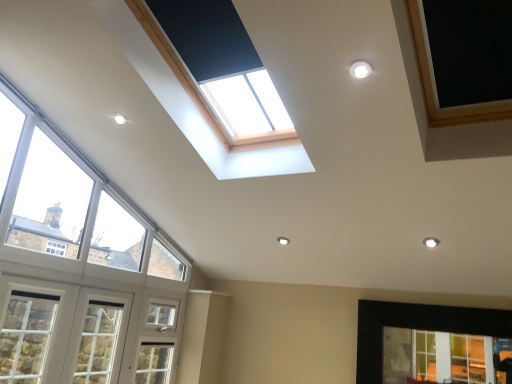
Measure the distance between point (18, 307) and camera.

A distance of 8.91 feet exists between point (18, 307) and camera.

What do you see at coordinates (26, 336) in the screenshot? I see `white painted wood window at lower left, placed as the fourth window when sorted from right to left` at bounding box center [26, 336].

The width and height of the screenshot is (512, 384). What do you see at coordinates (157, 342) in the screenshot? I see `white textured screen door at lower left` at bounding box center [157, 342].

Measure the distance between white textured screen door at lower left and camera.

The distance of white textured screen door at lower left from camera is 3.54 meters.

I want to click on white wood window at lower left, arranged as the third window when viewed from the right, so click(61, 332).

Is white textured screen door at lower left wider or thinner than white painted wood window at lower left, placed as the fourth window when sorted from right to left?

white textured screen door at lower left is thinner than white painted wood window at lower left, placed as the fourth window when sorted from right to left.

From the image's perspective, is white textured screen door at lower left above white painted wood window at lower left, placed as the fourth window when sorted from right to left?

No.

In the scene shown: From a real-world perspective, is white textured screen door at lower left positioned under white painted wood window at lower left, placed as the fourth window when sorted from right to left, based on gravity?

Yes, from a real-world perspective, white textured screen door at lower left is below white painted wood window at lower left, placed as the fourth window when sorted from right to left.

How different are the orientations of white textured screen door at lower left and white painted wood window at lower left, positioned as the 1th window in left-to-right order, in degrees?

The facing directions of white textured screen door at lower left and white painted wood window at lower left, positioned as the 1th window in left-to-right order, are 0.00046 degrees apart.

Can you see white wood window at lower left, arranged as the 2th window when viewed from the left, touching clear glass window at lower right, which is the fourth window from left to right?

They are not placed beside each other.

How distant is white wood window at lower left, arranged as the 2th window when viewed from the left, from clear glass window at lower right, the 1th window positioned from the right?

A distance of 7.52 feet exists between white wood window at lower left, arranged as the 2th window when viewed from the left, and clear glass window at lower right, the 1th window positioned from the right.

Does white wood window at lower left, arranged as the third window when viewed from the right, turn towards clear glass window at lower right, the 1th window positioned from the right?

Yes, white wood window at lower left, arranged as the third window when viewed from the right, is oriented towards clear glass window at lower right, the 1th window positioned from the right.

Who is more distant, white wood window at lower left, arranged as the third window when viewed from the right, or white textured screen door at lower left?

Positioned behind is white textured screen door at lower left.

Could you tell me if white wood window at lower left, arranged as the third window when viewed from the right, is turned towards white textured screen door at lower left?

No, white wood window at lower left, arranged as the third window when viewed from the right, is not oriented towards white textured screen door at lower left.

Can you confirm if white wood window at lower left, arranged as the third window when viewed from the right, is thinner than white textured screen door at lower left?

No.

From a real-world perspective, which object stands above the other?

clear glass window at left, placed as the third window when sorted from left to right.

In the scene shown: Is clear glass window at lower right, which is the fourth window from left to right, positioned with its back to clear glass window at left, which is the 2th window from right to left?

clear glass window at lower right, which is the fourth window from left to right, does not have its back to clear glass window at left, which is the 2th window from right to left.

Locate an element on the screen. the 3rd window in front when counting from the clear glass window at lower right, the 1th window positioned from the right is located at coordinates (77, 267).

Is clear glass window at lower right, the 1th window positioned from the right, far from clear glass window at left, which is the 2th window from right to left?

Yes, clear glass window at lower right, the 1th window positioned from the right, and clear glass window at left, which is the 2th window from right to left, are located far from each other.

From their relative heights in the image, would you say white painted wood window at lower left, positioned as the 1th window in left-to-right order, is taller or shorter than white textured screen door at lower left?

Considering their sizes, white painted wood window at lower left, positioned as the 1th window in left-to-right order, has less height than white textured screen door at lower left.

Is white painted wood window at lower left, placed as the fourth window when sorted from right to left, with white textured screen door at lower left?

No, white painted wood window at lower left, placed as the fourth window when sorted from right to left, is not next to white textured screen door at lower left.

Considering the relative sizes of white painted wood window at lower left, positioned as the 1th window in left-to-right order, and white textured screen door at lower left in the image provided, is white painted wood window at lower left, positioned as the 1th window in left-to-right order, bigger than white textured screen door at lower left?

No, white painted wood window at lower left, positioned as the 1th window in left-to-right order, is not bigger than white textured screen door at lower left.

Is the position of white painted wood window at lower left, positioned as the 1th window in left-to-right order, less distant than that of white textured screen door at lower left?

Yes, white painted wood window at lower left, positioned as the 1th window in left-to-right order, is closer to the viewer.

Does point (141, 350) come closer to viewer compared to point (386, 317)?

No.

From the image's perspective, is white textured screen door at lower left beneath clear glass window at lower right, the 1th window positioned from the right?

Yes, from the image's perspective, white textured screen door at lower left is below clear glass window at lower right, the 1th window positioned from the right.

Is white textured screen door at lower left beside clear glass window at lower right, the 1th window positioned from the right?

white textured screen door at lower left is not next to clear glass window at lower right, the 1th window positioned from the right, and they're not touching.

Is white textured screen door at lower left facing towards clear glass window at lower right, the 1th window positioned from the right?

Yes, white textured screen door at lower left is aimed at clear glass window at lower right, the 1th window positioned from the right.

Is clear glass window at left, placed as the third window when sorted from left to right, positioned with its back to white wood window at lower left, arranged as the third window when viewed from the right?

clear glass window at left, placed as the third window when sorted from left to right, does not have its back to white wood window at lower left, arranged as the third window when viewed from the right.

Looking at this image, from the image's perspective, would you say clear glass window at left, which is the 2th window from right to left, is positioned over white wood window at lower left, arranged as the 2th window when viewed from the left?

Yes, from the image's perspective, clear glass window at left, which is the 2th window from right to left, is above white wood window at lower left, arranged as the 2th window when viewed from the left.

From the clear glass window at left, which is the 2th window from right to left, count the 1st window to the left and point to it. Please provide its 2D coordinates.

[(61, 332)]

Choose the correct answer: Is clear glass window at left, which is the 2th window from right to left, inside white wood window at lower left, arranged as the third window when viewed from the right, or outside it?

clear glass window at left, which is the 2th window from right to left, is outside white wood window at lower left, arranged as the third window when viewed from the right.

Where is `window that is the 3rd object to the left of the white textured screen door at lower left, starting at the anchor`? The width and height of the screenshot is (512, 384). window that is the 3rd object to the left of the white textured screen door at lower left, starting at the anchor is located at coordinates (26, 336).

From the image's perspective, which window is the 1st one above the clear glass window at lower right, which is the fourth window from left to right? Please provide its 2D coordinates.

[(61, 332)]

Considering their positions, is white wood window at lower left, arranged as the third window when viewed from the right, positioned closer to clear glass window at left, placed as the third window when sorted from left to right, than white painted wood window at lower left, placed as the fourth window when sorted from right to left?

Based on the image, white wood window at lower left, arranged as the third window when viewed from the right, appears to be nearer to clear glass window at left, placed as the third window when sorted from left to right.

From the image, which object appears to be nearer to white textured screen door at lower left, clear glass window at left, placed as the third window when sorted from left to right, or white wood window at lower left, arranged as the 2th window when viewed from the left?

clear glass window at left, placed as the third window when sorted from left to right.

Estimate the real-world distances between objects in this image. Which object is further from white textured screen door at lower left, clear glass window at left, placed as the third window when sorted from left to right, or white painted wood window at lower left, positioned as the 1th window in left-to-right order?

The object further to white textured screen door at lower left is white painted wood window at lower left, positioned as the 1th window in left-to-right order.

Looking at the image, which one is located further to clear glass window at lower right, the 1th window positioned from the right, white textured screen door at lower left or white painted wood window at lower left, placed as the fourth window when sorted from right to left?

white painted wood window at lower left, placed as the fourth window when sorted from right to left, lies further to clear glass window at lower right, the 1th window positioned from the right, than the other object.

Looking at the image, which one is located further to white painted wood window at lower left, positioned as the 1th window in left-to-right order, clear glass window at lower right, which is the fourth window from left to right, or clear glass window at left, placed as the third window when sorted from left to right?

clear glass window at lower right, which is the fourth window from left to right.

Considering their positions, is white wood window at lower left, arranged as the 2th window when viewed from the left, positioned further to clear glass window at lower right, the 1th window positioned from the right, than clear glass window at left, which is the 2th window from right to left?

white wood window at lower left, arranged as the 2th window when viewed from the left, lies further to clear glass window at lower right, the 1th window positioned from the right, than the other object.

Considering their positions, is clear glass window at left, placed as the third window when sorted from left to right, positioned closer to white painted wood window at lower left, placed as the fourth window when sorted from right to left, than white wood window at lower left, arranged as the third window when viewed from the right?

white wood window at lower left, arranged as the third window when viewed from the right.

From the picture: From the image, which object appears to be farther from clear glass window at lower right, the 1th window positioned from the right, white textured screen door at lower left or clear glass window at left, placed as the third window when sorted from left to right?

clear glass window at left, placed as the third window when sorted from left to right, is positioned further to the anchor clear glass window at lower right, the 1th window positioned from the right.

This screenshot has height=384, width=512. Find the location of `screen door between clear glass window at left, which is the 2th window from right to left, and clear glass window at lower right, which is the fourth window from left to right, from left to right`. screen door between clear glass window at left, which is the 2th window from right to left, and clear glass window at lower right, which is the fourth window from left to right, from left to right is located at coordinates (157, 342).

Locate an element on the screen. The image size is (512, 384). screen door between white painted wood window at lower left, placed as the fourth window when sorted from right to left, and clear glass window at lower right, the 1th window positioned from the right is located at coordinates (157, 342).

Locate an element on the screen. The width and height of the screenshot is (512, 384). screen door between white wood window at lower left, arranged as the third window when viewed from the right, and clear glass window at lower right, which is the fourth window from left to right is located at coordinates (157, 342).

I want to click on window that lies between clear glass window at left, which is the 2th window from right to left, and white wood window at lower left, arranged as the third window when viewed from the right, from top to bottom, so click(26, 336).